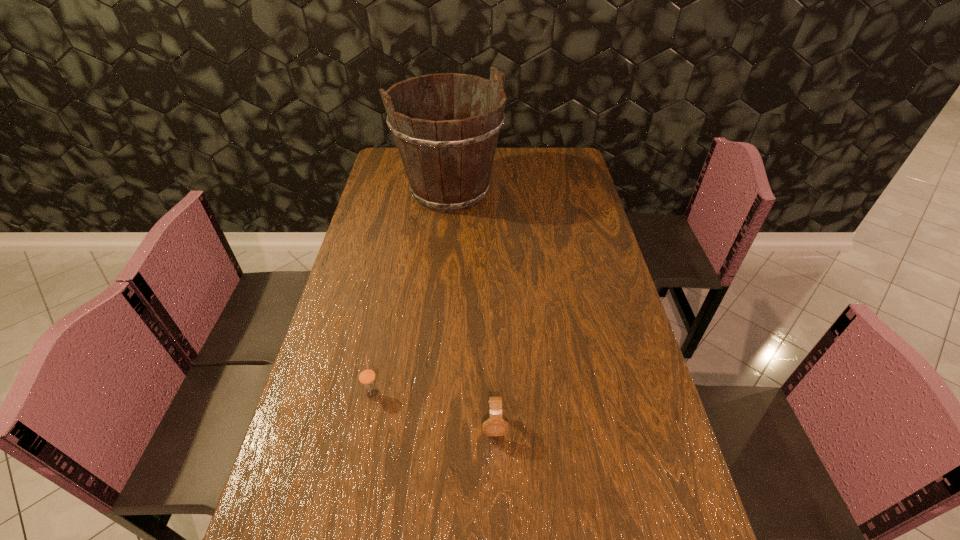
Locate an element on the screen. bucket located at the left edge is located at coordinates (448, 158).

Identify the location of straw that is at the left edge. (366, 375).

Find the location of a particular element. object at the far left corner is located at coordinates (448, 158).

Find the location of a particular element. This screenshot has height=540, width=960. free space at the far edge of the desktop is located at coordinates coord(524,170).

Where is `vacant space at the left edge`? vacant space at the left edge is located at coordinates (377, 208).

The width and height of the screenshot is (960, 540). I want to click on vacant space at the right edge of the desktop, so coord(647,423).

You are a GUI agent. You are given a task and a screenshot of the screen. Output one action in this format:
    pyautogui.click(x=<x>, y=<y>)
    Task: Click on the blank area at the far left corner
    
    Given the screenshot: What is the action you would take?
    pyautogui.click(x=392, y=158)

Identify the location of unoccupied position between the nearest object and the farthest object. The height and width of the screenshot is (540, 960). (472, 309).

The width and height of the screenshot is (960, 540). Find the location of `empty space that is in between the farthest object and the nearest object`. empty space that is in between the farthest object and the nearest object is located at coordinates (472, 309).

The width and height of the screenshot is (960, 540). I want to click on unoccupied position between the tallest object and the straw, so click(x=411, y=292).